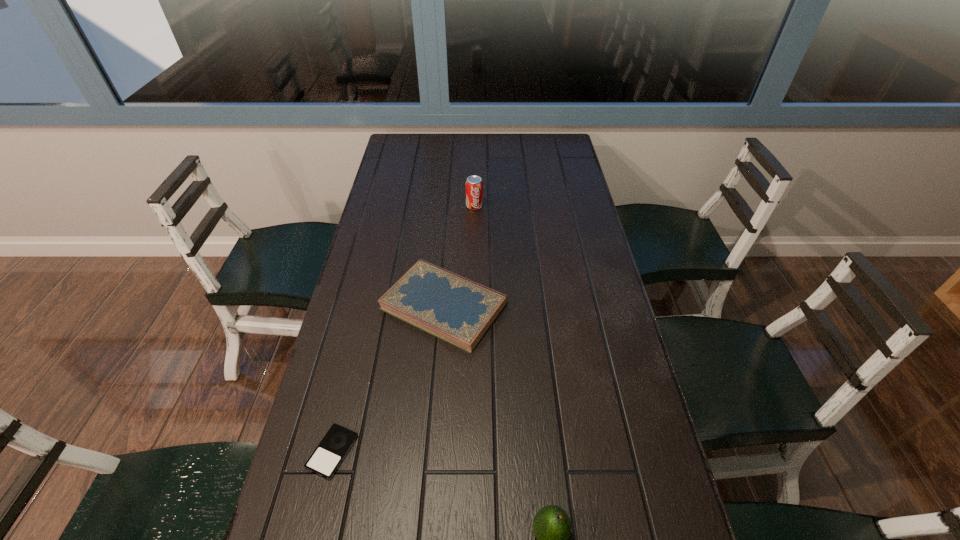
I want to click on soda can, so click(x=474, y=186).

This screenshot has width=960, height=540. What are the coordinates of `the third tallest object` in the screenshot? It's located at (457, 310).

Find the location of `the second farthest object`. the second farthest object is located at coordinates (457, 310).

This screenshot has height=540, width=960. In order to click on the third farthest object in this screenshot , I will do pos(331,451).

The width and height of the screenshot is (960, 540). I want to click on iPod, so point(331,451).

Identify the location of free space located 0.280m on the back of the soda can. The height and width of the screenshot is (540, 960). (475, 160).

This screenshot has height=540, width=960. What are the coordinates of `free space located 0.160m on the back of the paperback book` in the screenshot? It's located at (449, 232).

Identify the location of vacant point located 0.060m on the right of the shortest object. (384, 451).

The height and width of the screenshot is (540, 960). In order to click on paperback book that is at the left edge in this screenshot , I will do `click(457, 310)`.

You are a GUI agent. You are given a task and a screenshot of the screen. Output one action in this format:
    pyautogui.click(x=<x>, y=<y>)
    Task: Click on the iPod that is at the left edge
    
    Given the screenshot: What is the action you would take?
    pyautogui.click(x=331, y=451)